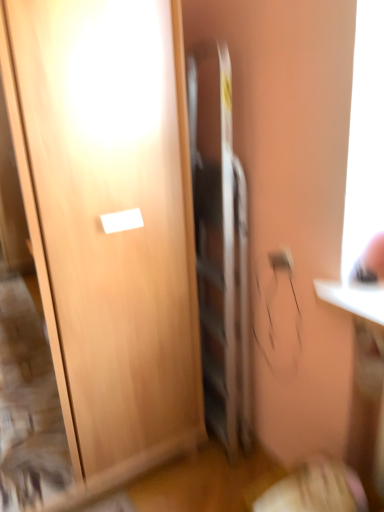
The width and height of the screenshot is (384, 512). I want to click on matte gray outlet at upper right, so click(281, 259).

Describe the element at coordinates (281, 259) in the screenshot. I see `matte gray outlet at upper right` at that location.

This screenshot has height=512, width=384. Find the location of `matte gray outlet at upper right`. matte gray outlet at upper right is located at coordinates (281, 259).